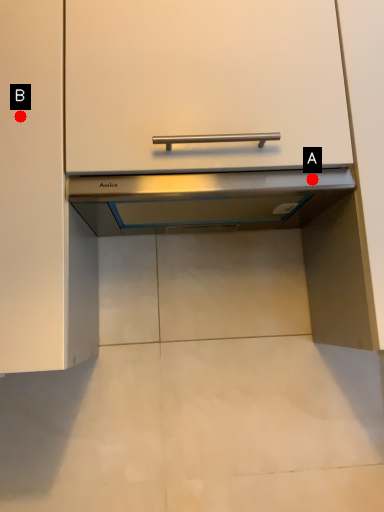
Question: Two points are circled on the image, labeled by A and B beside each circle. Which point appears closest to the camera in this image?

Choices:
 (A) A is closer
 (B) B is closer

Answer: (B)